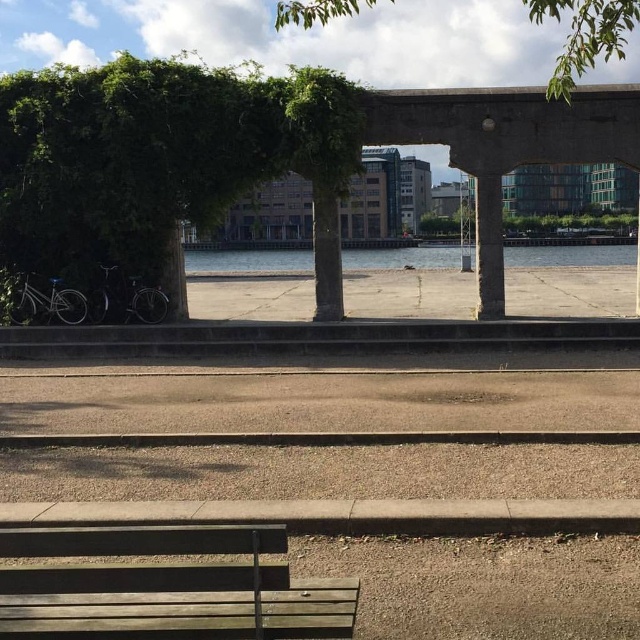
Between green leafy tree at upper center and clear water at center, which one has more height?

green leafy tree at upper center is taller.

Where is `green leafy tree at upper center`? This screenshot has width=640, height=640. green leafy tree at upper center is located at coordinates (584, 36).

Identify the location of green leafy tree at upper center. Image resolution: width=640 pixels, height=640 pixels. (584, 36).

Can you confirm if green leafy tree at left is wider than wooden bench at lower center?

Yes.

Who is more forward, (305,140) or (280,593)?

Point (280,593) is more forward.

Locate an element on the screen. green leafy tree at left is located at coordinates (164, 160).

Does green leafy tree at left appear on the right side of green leafy tree at upper center?

Incorrect, green leafy tree at left is not on the right side of green leafy tree at upper center.

Who is positioned more to the right, green leafy tree at left or green leafy tree at upper center?

Positioned to the right is green leafy tree at upper center.

You are a GUI agent. You are given a task and a screenshot of the screen. Output one action in this format:
    pyautogui.click(x=<x>, y=<y>)
    Task: Click on the green leafy tree at left
    This screenshot has height=640, width=640.
    Given the screenshot: What is the action you would take?
    pyautogui.click(x=164, y=160)